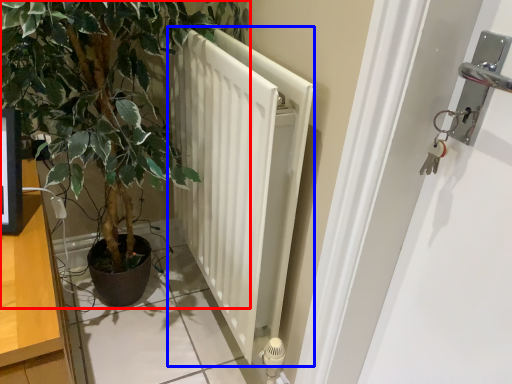
Question: Which object is further to the camera taking this photo, houseplant (highlighted by a red box) or radiator (highlighted by a blue box)?

Choices:
 (A) houseplant
 (B) radiator

Answer: (B)